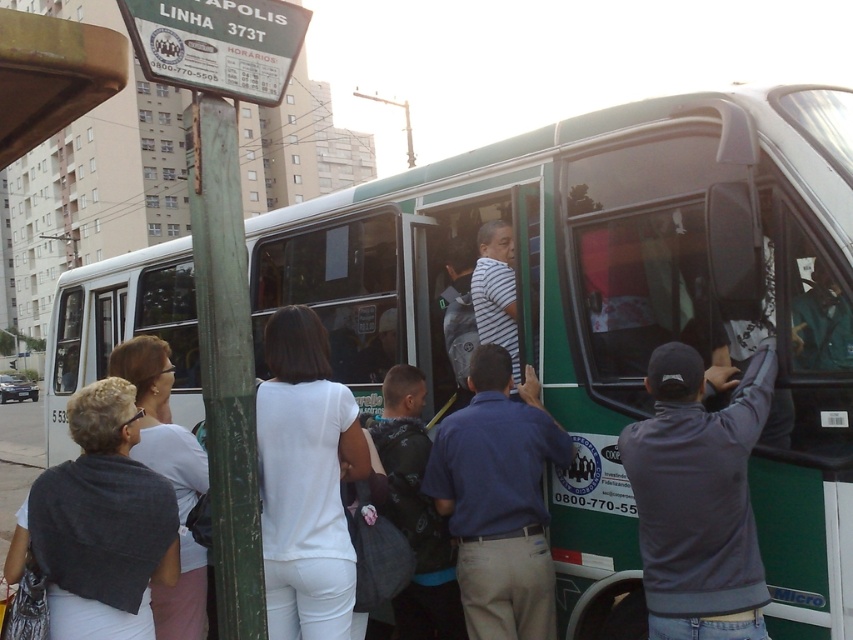
Who is more distant from viewer, (86, 573) or (508, 637)?

The point (508, 637) is more distant.

What do you see at coordinates (99, 524) in the screenshot? The width and height of the screenshot is (853, 640). I see `white fabric shawl at lower left` at bounding box center [99, 524].

Which is in front, point (88, 449) or point (492, 545)?

Positioned in front is point (88, 449).

This screenshot has width=853, height=640. I want to click on white fabric shawl at lower left, so click(x=99, y=524).

Which of these two, gray fleece jacket at center or white fabric shawl at lower left, stands shorter?

white fabric shawl at lower left

Who is more forward, (722, 476) or (122, 438)?

Positioned in front is point (722, 476).

Identify the location of gray fleece jacket at center. (698, 499).

Who is higher up, white matte shirt at center or white fabric shirt at left?

Positioned higher is white matte shirt at center.

Between white matte shirt at center and white fabric shirt at left, which one has more height?

Standing taller between the two is white fabric shirt at left.

Where is `white matte shirt at center`? This screenshot has height=640, width=853. white matte shirt at center is located at coordinates (305, 481).